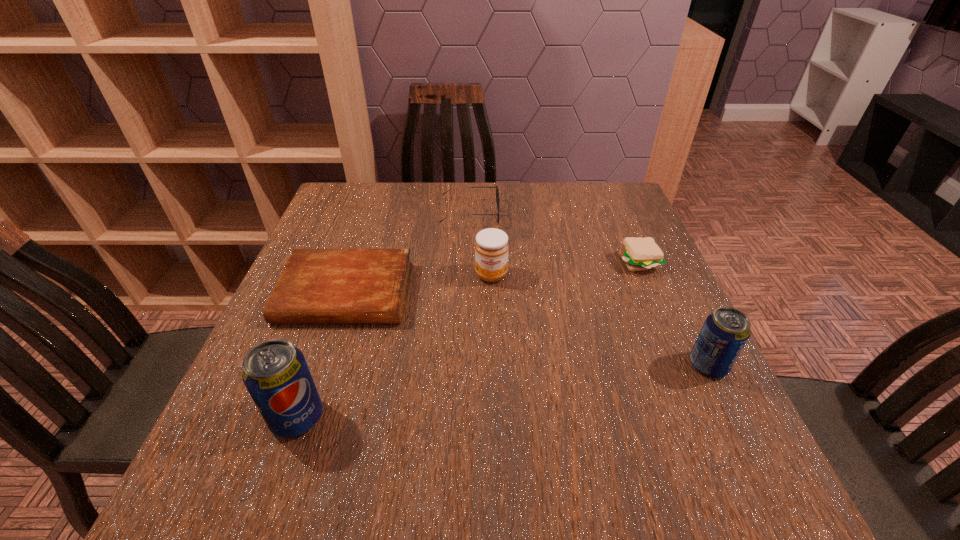
Please point a location where one more pop_(soda) can be added evenly. Please provide its 2D coordinates. Your answer should be formatted as a tuple, i.e. [(x, y)], where the tuple contains the x and y coordinates of a point satisfying the conditions above.

[(514, 389)]